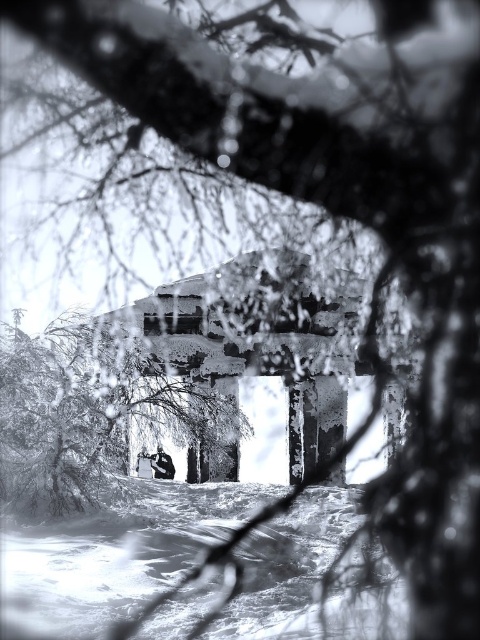
Can you confirm if white powdery snow at lower center is wider than snow-covered branches at center?

Indeed, white powdery snow at lower center has a greater width compared to snow-covered branches at center.

Between white powdery snow at lower center and snow-covered branches at center, which one is positioned lower?

white powdery snow at lower center

At what (x,y) coordinates should I click in order to perform the action: click on white powdery snow at lower center. Please return your answer as a coordinate pair (x, y). Image resolution: width=480 pixels, height=640 pixels. Looking at the image, I should click on (115, 554).

At what (x,y) coordinates should I click in order to perform the action: click on white powdery snow at lower center. Please return your answer as a coordinate pair (x, y). The width and height of the screenshot is (480, 640). Looking at the image, I should click on (115, 554).

How far apart are snow-covered branches at center and dark gray fabric jacket at center?

snow-covered branches at center is 2.69 meters from dark gray fabric jacket at center.

In the scene shown: Can you confirm if snow-covered branches at center is positioned above dark gray fabric jacket at center?

Correct, snow-covered branches at center is located above dark gray fabric jacket at center.

Between point (59, 332) and point (167, 460), which one is positioned behind?

Positioned behind is point (167, 460).

I want to click on snow-covered branches at center, so click(88, 413).

Does white powdery snow at lower center have a lesser height compared to dark gray fabric jacket at center?

In fact, white powdery snow at lower center may be taller than dark gray fabric jacket at center.

Which is below, white powdery snow at lower center or dark gray fabric jacket at center?

dark gray fabric jacket at center

Between point (131, 604) and point (155, 468), which one is positioned in front?

Point (131, 604)

The height and width of the screenshot is (640, 480). What are the coordinates of `white powdery snow at lower center` in the screenshot? It's located at (115, 554).